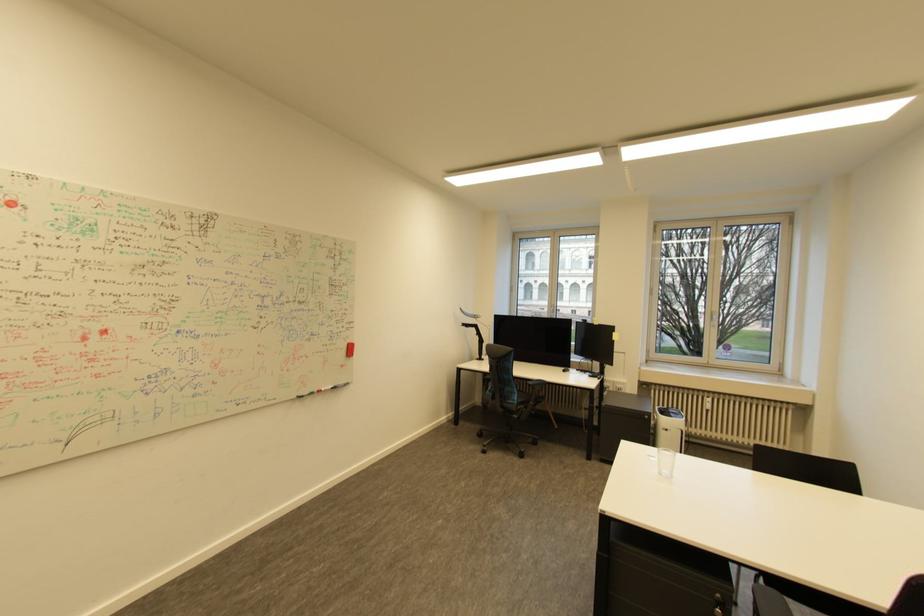
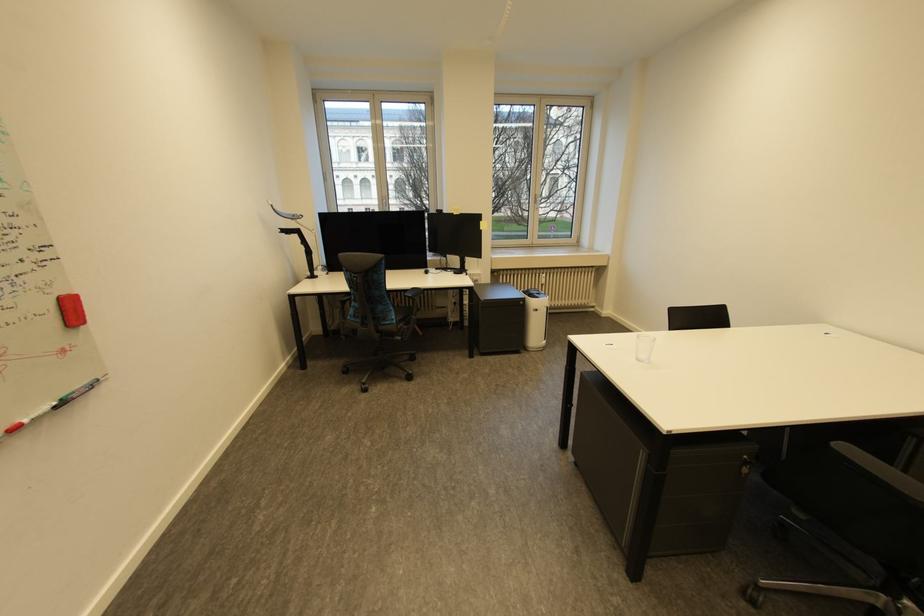
The point at (355, 345) is marked in the first image. Where is the corresponding point in the second image?

(67, 300)